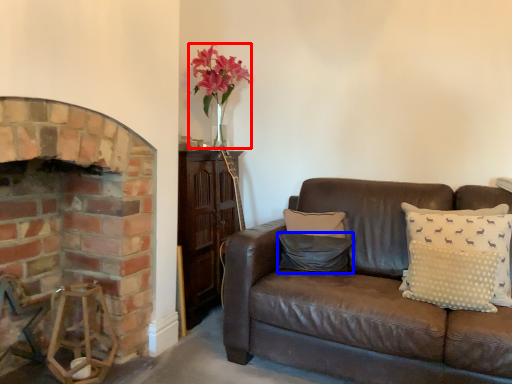
Question: Which of the following is the farthest to the observer, floral arrangement (highlighted by a red box) or pillow (highlighted by a blue box)?

Choices:
 (A) floral arrangement
 (B) pillow

Answer: (A)